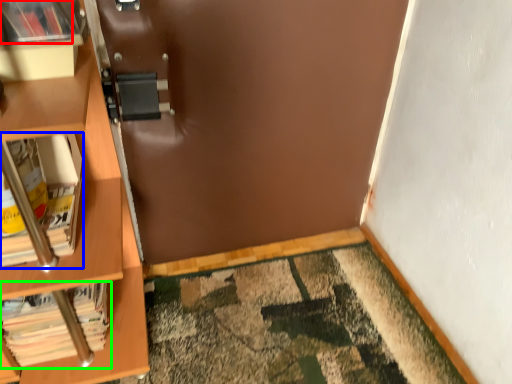
Question: Based on their relative distances, which object is nearer to book (highlighted by a red box)? Choose from book (highlighted by a blue box) and book (highlighted by a green box).

Choices:
 (A) book
 (B) book

Answer: (A)